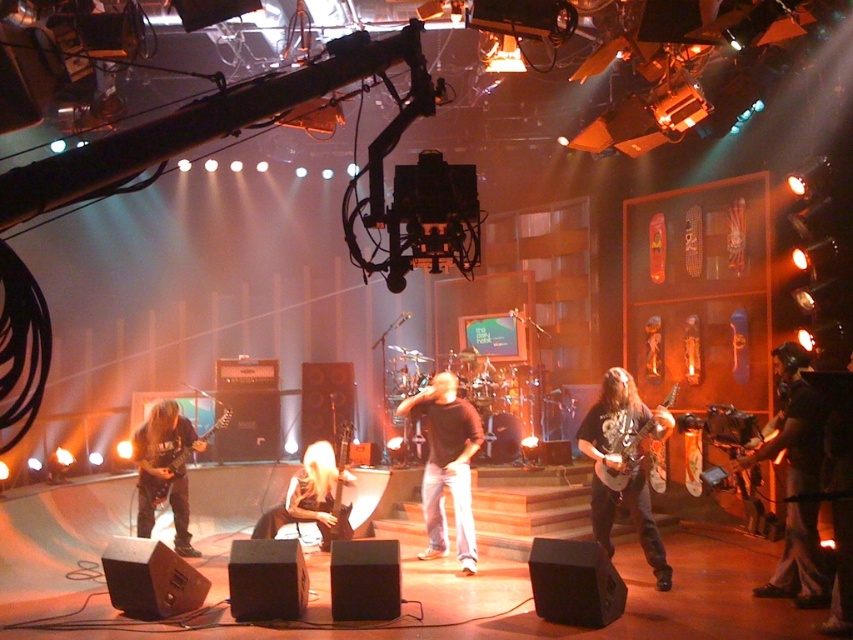
Can you confirm if dark brown leather jacket at lower right is wider than brown matte shirt at center?

No, dark brown leather jacket at lower right is not wider than brown matte shirt at center.

Does dark brown leather jacket at lower right have a larger size compared to brown matte shirt at center?

No, dark brown leather jacket at lower right is not bigger than brown matte shirt at center.

Is point (779, 580) positioned before point (430, 547)?

Yes, point (779, 580) is in front of point (430, 547).

The height and width of the screenshot is (640, 853). Identify the location of dark brown leather jacket at lower right. (795, 481).

Does brown matte shirt at center have a lesser width compared to shiny metallic guitar at center right?

Correct, brown matte shirt at center's width is less than shiny metallic guitar at center right's.

Between point (460, 481) and point (601, 468), which one is positioned behind?

The point (460, 481) is more distant.

This screenshot has height=640, width=853. In order to click on brown matte shirt at center in this screenshot , I will do `click(447, 465)`.

Can you confirm if brown matte shirt at center is wider than metallic silver guitar at center?

Correct, the width of brown matte shirt at center exceeds that of metallic silver guitar at center.

Is point (437, 532) behind point (334, 481)?

No, (437, 532) is closer to viewer.

Image resolution: width=853 pixels, height=640 pixels. Identify the location of brown matte shirt at center. (447, 465).